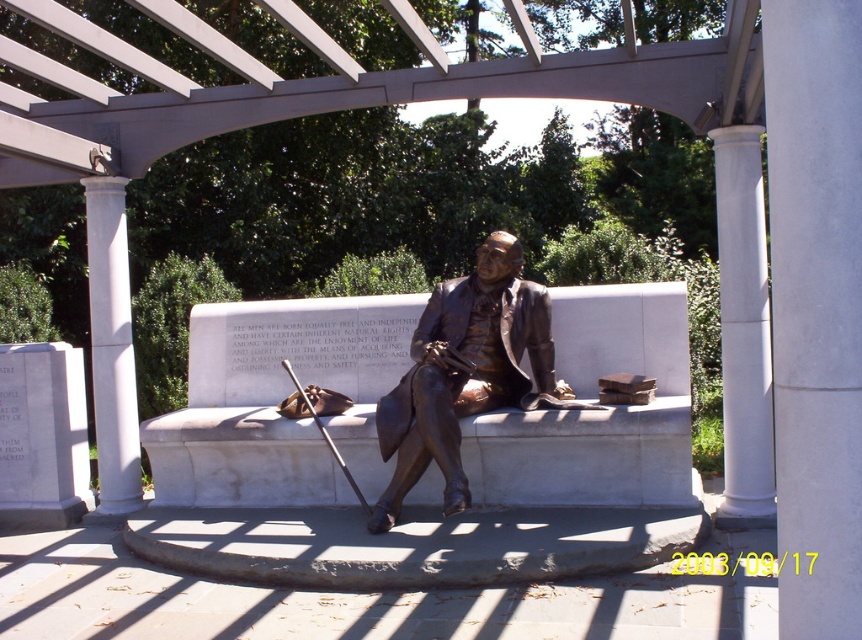
Looking at this image, you are a photographer standing at the camera position. You want to take a photo of the bronze statue at center. The recommended minimum distance for this camera is 5 meters to avoid distortion. Can you take the photo without distortion?

The bronze statue at center and camera are 4.89 meters apart. Since the minimum required distance is 5 meters, the photographer cannot take the photo without distortion as the distance is insufficient.

Looking at the white marble column at right and the white marble column at left in the scene, which one is positioned more to the east side of the image?

The white marble column at right is positioned more to the east side of the image because it is to the right of the white marble column at left.